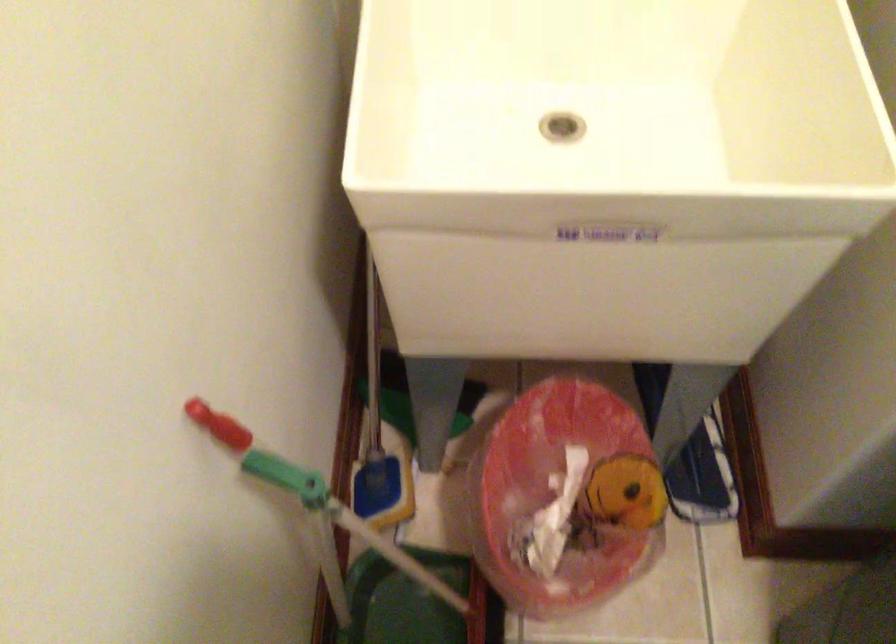
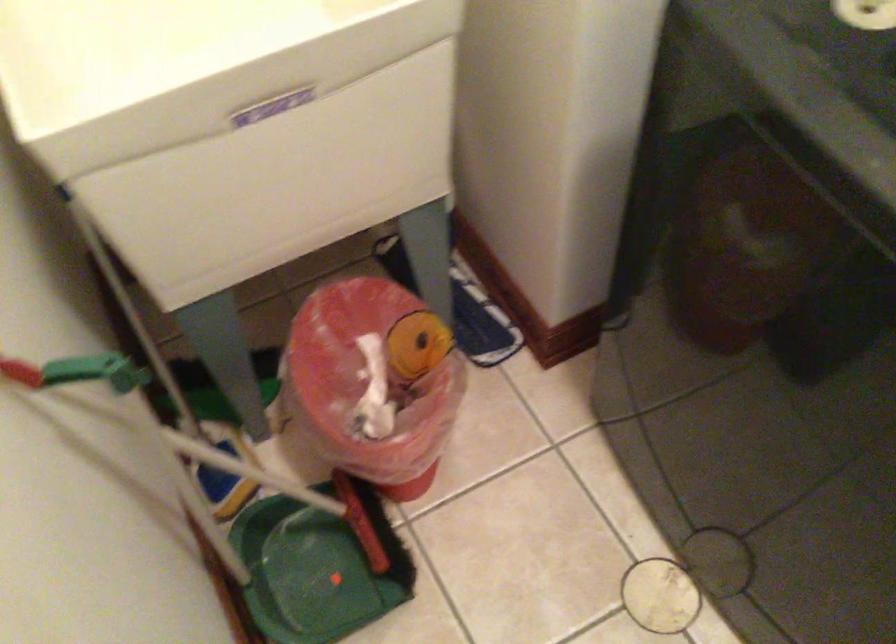
Find the pixel in the second image that matches pixel 268 478 in the first image.

(90, 415)